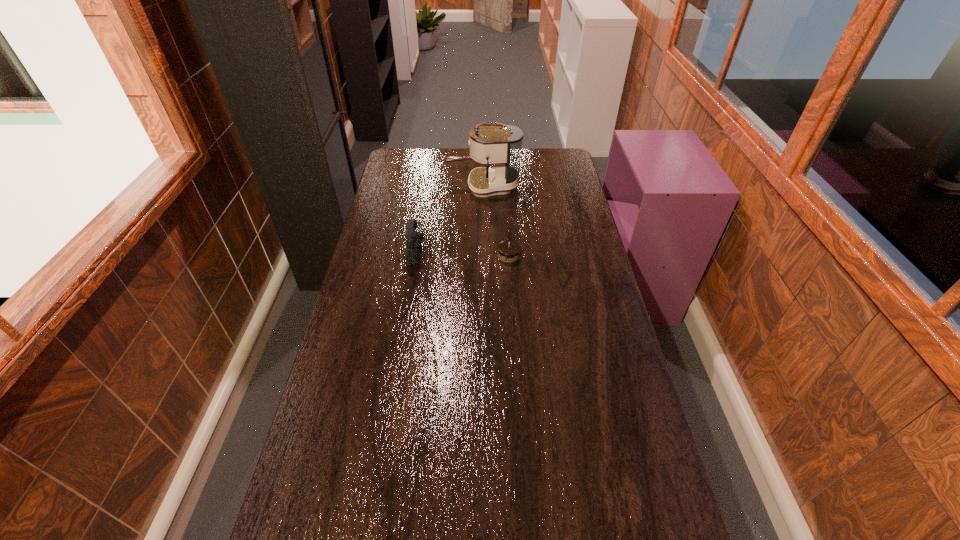
Locate an element on the screen. free space that satisfies the following two spatial constraints: 1. on the headband of the leftmost object; 2. on the right side of the chocolate cake is located at coordinates (415, 255).

Where is `free space that satisfies the following two spatial constraints: 1. on the headband of the leftmost object; 2. on the right side of the chocolate cake`? free space that satisfies the following two spatial constraints: 1. on the headband of the leftmost object; 2. on the right side of the chocolate cake is located at coordinates (415, 255).